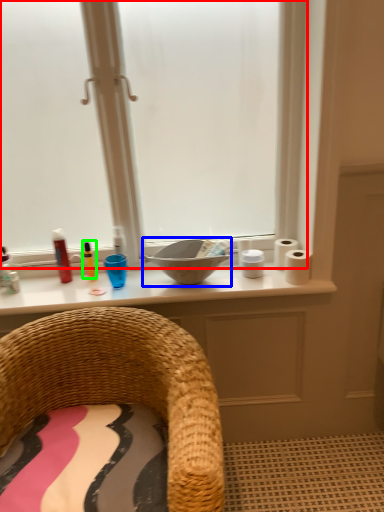
Question: Considering the real-world distances, which object is farthest from window (highlighted by a red box)? sink (highlighted by a blue box) or toiletry (highlighted by a green box)?

Choices:
 (A) sink
 (B) toiletry

Answer: (A)